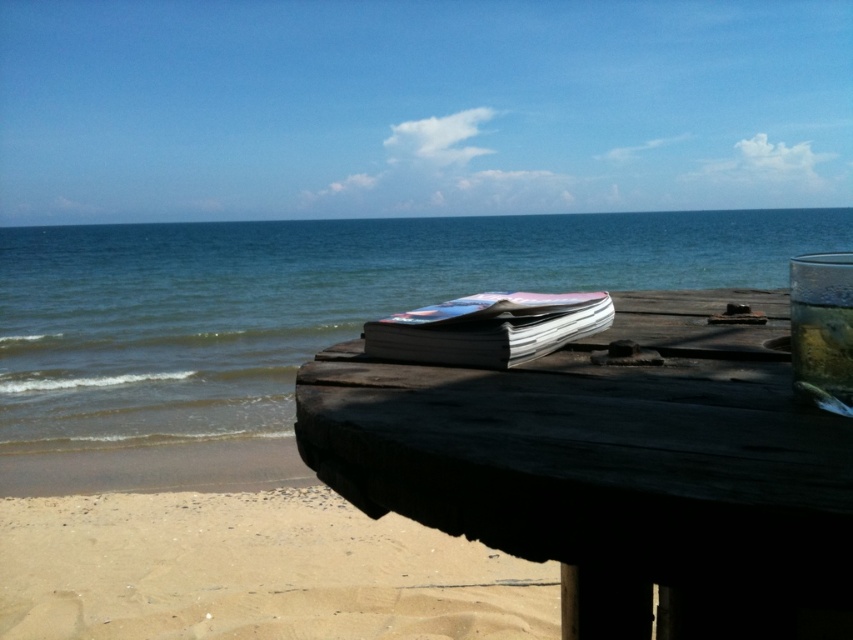
You are a photographer setting up a tripod to capture the beach scene. You want to position the tripod so that the dark wood picnic table at center is clearly visible in front of the light beige sand at lower left. Is this possible given their positions?

Yes, the dark wood picnic table at center is in front of the light beige sand at lower left, so positioning the tripod to have the picnic table visible in front of the sand is possible.